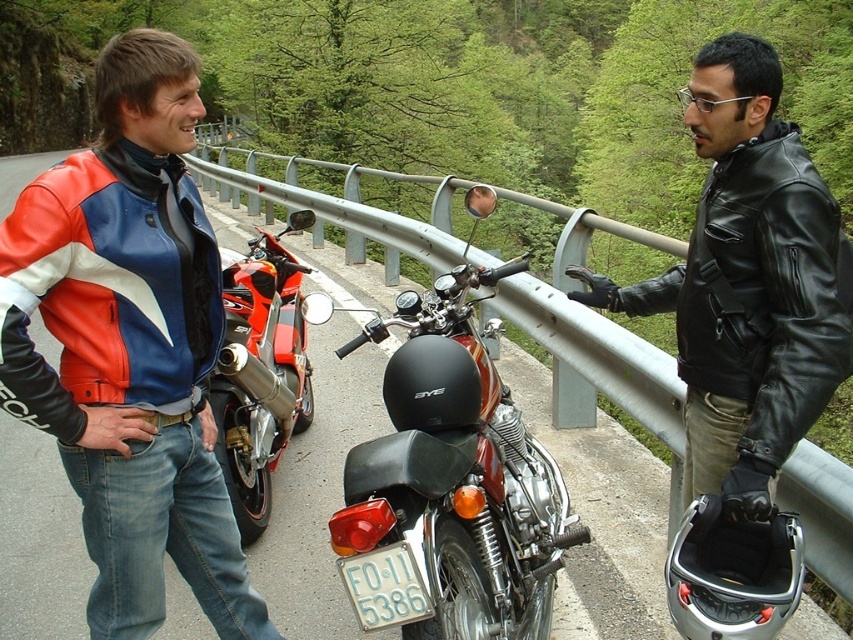
Does leather jacket at left have a smaller size compared to shiny red sportbike at left?

Answer: Correct, leather jacket at left occupies less space than shiny red sportbike at left.

Describe the element at coordinates (131, 346) in the screenshot. This screenshot has height=640, width=853. I see `leather jacket at left` at that location.

Where is `leather jacket at left`? leather jacket at left is located at coordinates (131, 346).

Which is more to the left, leather jacket at left or black leather jacket at center?

leather jacket at left is more to the left.

Between leather jacket at left and black leather jacket at center, which one is positioned higher?

Positioned higher is black leather jacket at center.

Who is more distant from viewer, (1, 301) or (747, 352)?

Positioned behind is point (747, 352).

The width and height of the screenshot is (853, 640). Find the location of `leather jacket at left`. leather jacket at left is located at coordinates (131, 346).

Can you confirm if shiny red sportbike at left is wider than white plastic license plate at center?

Indeed, shiny red sportbike at left has a greater width compared to white plastic license plate at center.

Find the location of `shiny red sportbike at left`. shiny red sportbike at left is located at coordinates (260, 372).